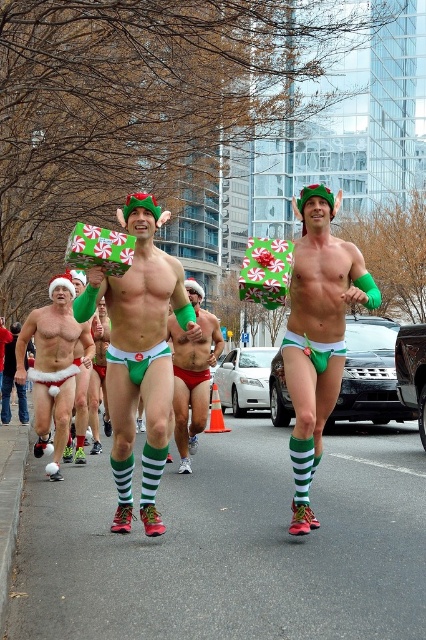
Who is positioned more to the left, matte green fabric gift at center or matte green underwear at center?

From the viewer's perspective, matte green fabric gift at center appears more on the left side.

Identify the location of matte green fabric gift at center. The height and width of the screenshot is (640, 426). (138, 356).

Is matte green fabric gift at center to the left of green matte socks at center from the viewer's perspective?

Yes, matte green fabric gift at center is to the left of green matte socks at center.

Is point (322, 420) in front of point (187, 401)?

Yes, it is in front of point (187, 401).

Which is behind, point (170, 388) or point (199, 406)?

Point (199, 406)

Identify the location of matte green fabric gift at center. (138, 356).

Is the position of matte green fabric gift at center less distant than that of green matte underwear at center?

Yes, matte green fabric gift at center is in front of green matte underwear at center.

Does matte green fabric gift at center have a lesser width compared to green matte underwear at center?

No.

What do you see at coordinates (138, 356) in the screenshot?
I see `matte green fabric gift at center` at bounding box center [138, 356].

Identify the location of matte green fabric gift at center. The height and width of the screenshot is (640, 426). (138, 356).